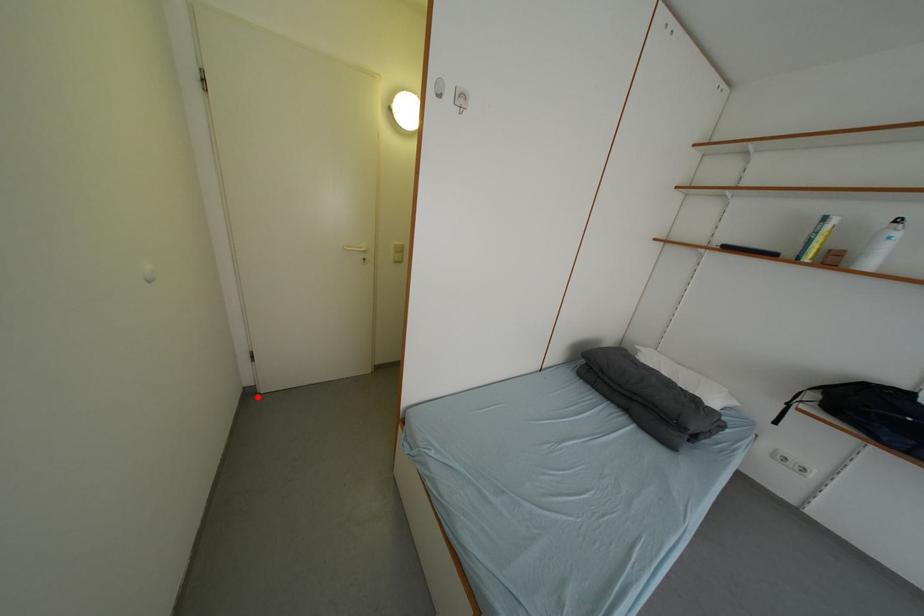
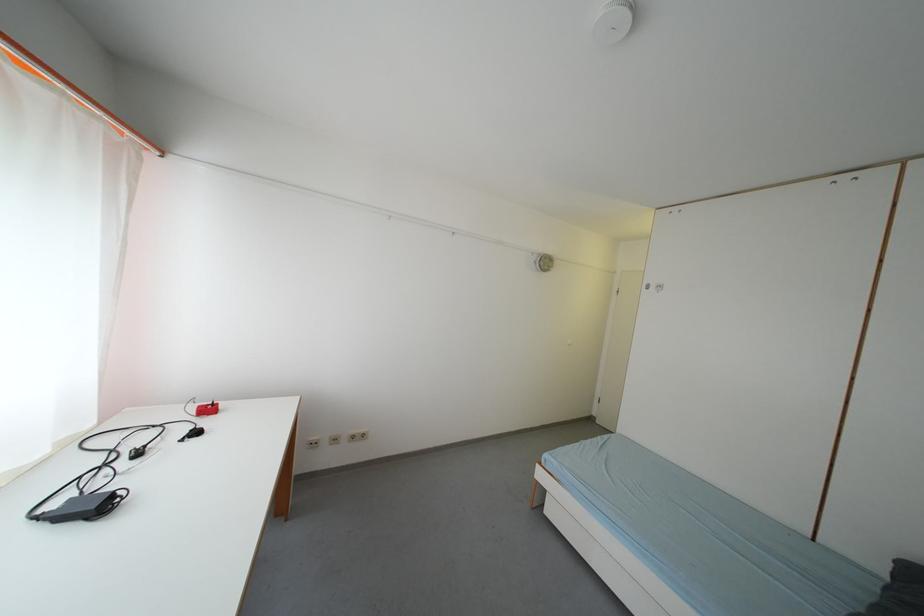
Question: I am providing you with two images of the same scene from different viewpoints. A red point is shown in image1. For the corresponding object point in image2, is it positioned nearer or farther from the camera?

Choices:
 (A) Nearer
 (B) Farther

Answer: (B)